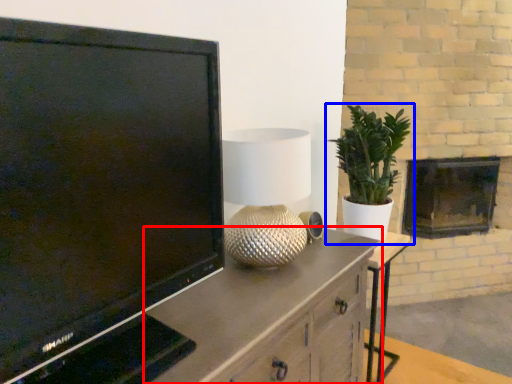
Question: Which point is further to the camera, cabinetry (highlighted by a red box) or houseplant (highlighted by a blue box)?

Choices:
 (A) cabinetry
 (B) houseplant

Answer: (B)